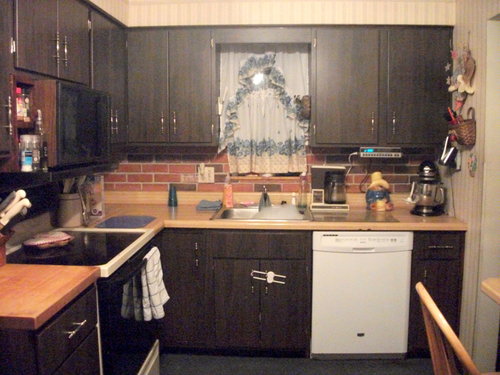
You are a GUI agent. You are given a task and a screenshot of the screen. Output one action in this format:
    pyautogui.click(x=<x>, y=<y>)
    Task: Click on the microwave
    This screenshot has height=375, width=500.
    Given the screenshot: What is the action you would take?
    click(79, 135)